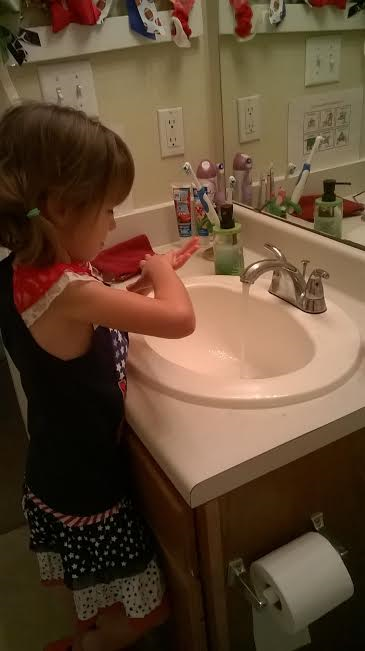
Where is `sink`? The image size is (365, 651). sink is located at coordinates (216, 359).